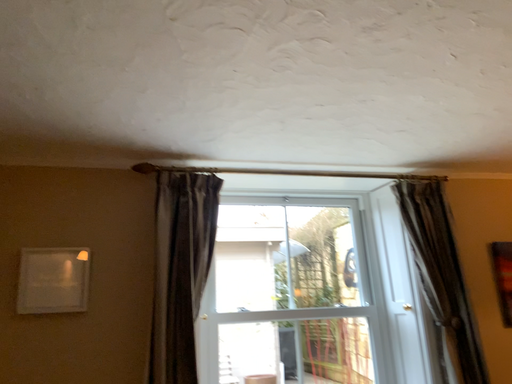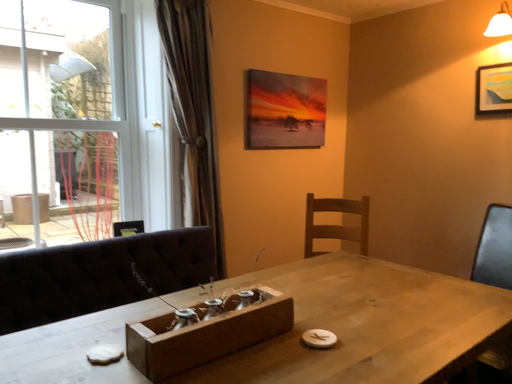
Question: Which way did the camera rotate in the video?

Choices:
 (A) rotated left
 (B) rotated right

Answer: (B)